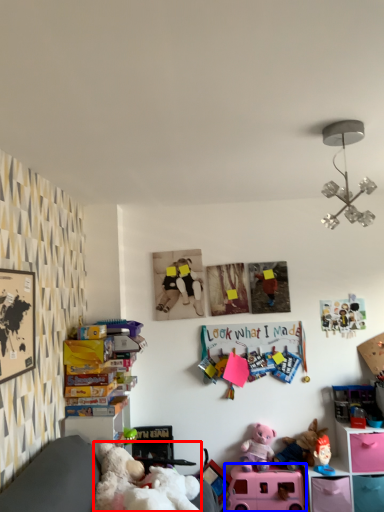
Question: Among these objects, which one is nearest to the camera, teddy (highlighted by a red box) or toy (highlighted by a blue box)?

Choices:
 (A) teddy
 (B) toy

Answer: (A)